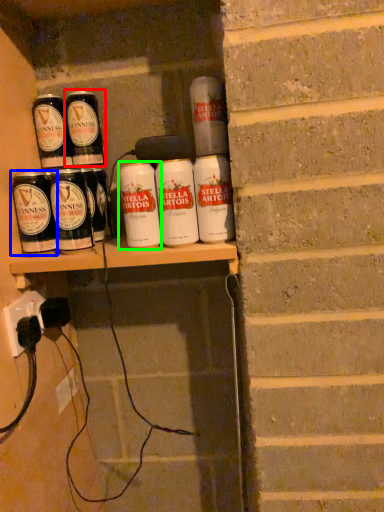
Question: Which is farther away from tin can (highlighted by a red box)? tin can (highlighted by a blue box) or tin can (highlighted by a green box)?

Choices:
 (A) tin can
 (B) tin can

Answer: (B)